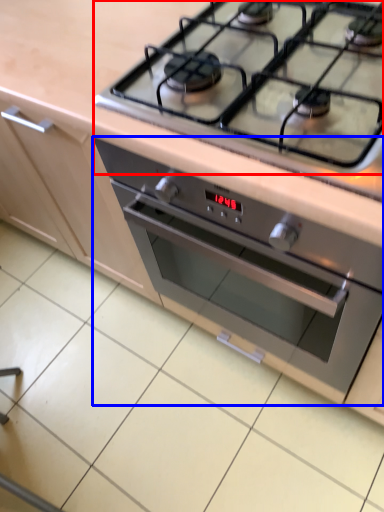
Question: Which object appears farthest to the camera in this image, gas stove (highlighted by a red box) or oven (highlighted by a blue box)?

Choices:
 (A) gas stove
 (B) oven

Answer: (B)